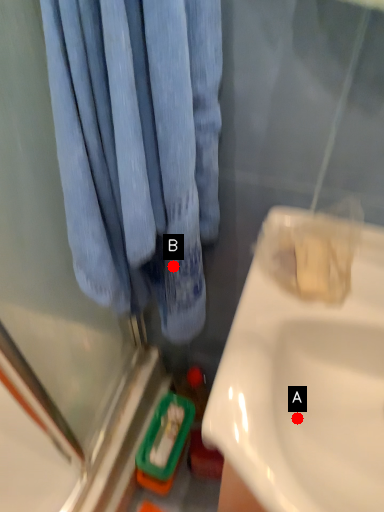
Question: Two points are circled on the image, labeled by A and B beside each circle. Among these points, which one is nearest to the camera?

Choices:
 (A) A is closer
 (B) B is closer

Answer: (A)